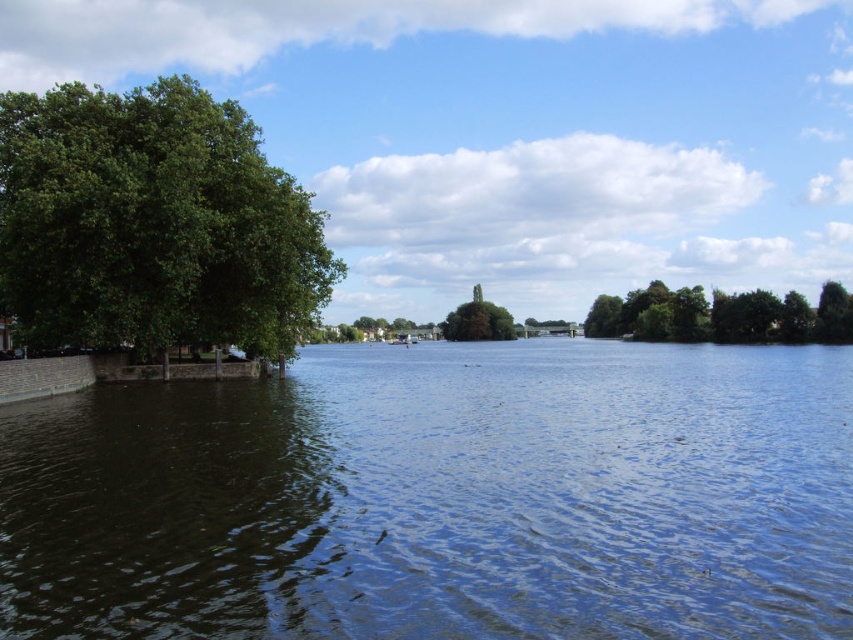
What do you see at coordinates (152, 224) in the screenshot? This screenshot has width=853, height=640. I see `green leafy tree at left` at bounding box center [152, 224].

Where is `green leafy tree at left`? Image resolution: width=853 pixels, height=640 pixels. green leafy tree at left is located at coordinates click(152, 224).

Does dark blue water at center have a lesser height compared to green leafy tree at left?

Indeed, dark blue water at center has a lesser height compared to green leafy tree at left.

Does dark blue water at center appear under green leafy tree at left?

Indeed, dark blue water at center is positioned under green leafy tree at left.

Does point (683, 561) lie behind point (26, 337)?

That is False.

The height and width of the screenshot is (640, 853). I want to click on dark blue water at center, so click(x=440, y=497).

Describe the element at coordinates (440, 497) in the screenshot. I see `dark blue water at center` at that location.

Which is more to the right, dark blue water at center or green leafy tree at center?

Positioned to the right is green leafy tree at center.

Which is in front, point (305, 428) or point (451, 314)?

Point (305, 428)

Identify the location of dark blue water at center. (440, 497).